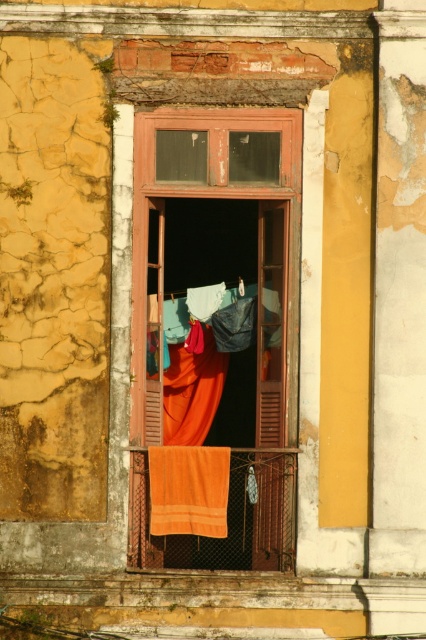
You are standing in front of the weathered building facade. You notice two points marked on the wall. The first point is at coordinates point [262,348] and the second is at point [203,406]. Which point appears closer to you?

Point [262,348] is closer to the viewer than point [203,406].

You are standing in front of the building and notice the wooden window at center and the orange fabric curtain at center. Which object is positioned higher from the ground?

The wooden window at center is located above the orange fabric curtain at center, so it is positioned higher from the ground.

From the picture: You are standing in front of the building and notice two orange items hanging near the window. Which one is nearer to you, the orange towel at lower center or the orange fabric curtain at center?

The orange towel at lower center is closer to the viewer than the orange fabric curtain at center.